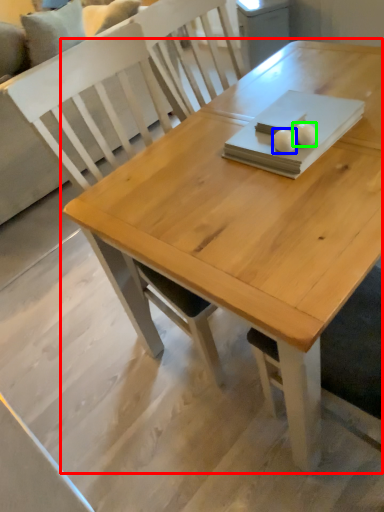
Question: Considering the real-world distances, which object is closest to table (highlighted by a red box)? food (highlighted by a blue box) or food (highlighted by a green box).

Choices:
 (A) food
 (B) food

Answer: (A)